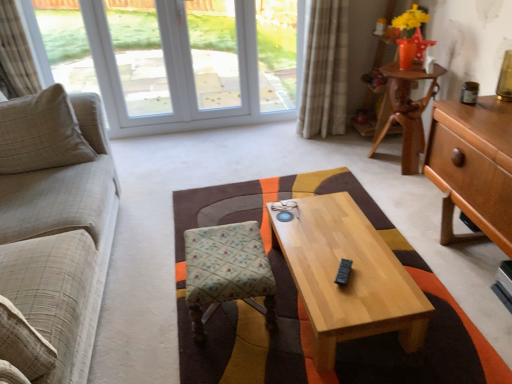
Question: In the image, is white plastic window at upper left positioned in front of or behind matte brown jar at upper right?

Choices:
 (A) behind
 (B) front

Answer: (A)

Question: Does point [189, 77] appear closer or farther from the camera than point [473, 91]?

Choices:
 (A) farther
 (B) closer

Answer: (A)

Question: Based on their relative distances, which object is farther from the patterned fabric stool at center?

Choices:
 (A) white plastic window at upper left
 (B) light wood/texture coffee table at center
 (C) beige textured curtain at left, the 2th curtain positioned from the right
 (D) beige plaid fabric couch at left
 (E) patterned fabric cushion at center

Answer: (A)

Question: Based on their relative distances, which object is nearer to the white plastic window at upper left?

Choices:
 (A) beige fabric pillow at left
 (B) matte brown jar at upper right
 (C) beige textured curtain at left, positioned as the 1th curtain in left-to-right order
 (D) beige plaid fabric couch at left
 (E) patterned fabric cushion at center

Answer: (C)